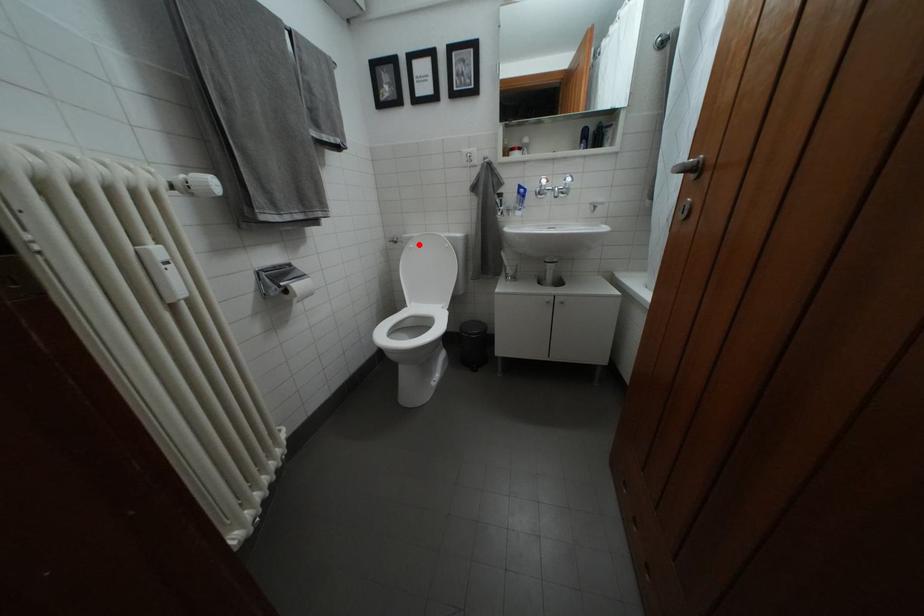
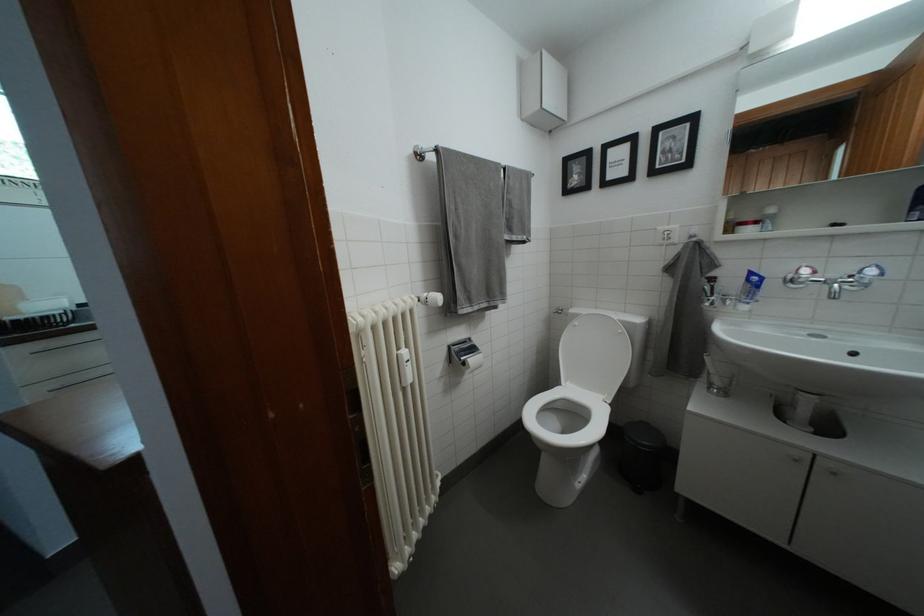
Where in the second image is the point corresponding to the highlighted location from the first image?

(585, 321)